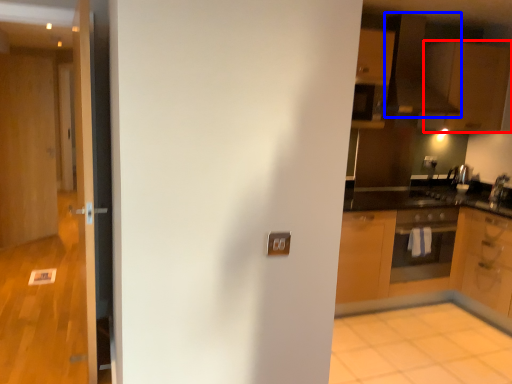
Question: Which of the following is the closest to the observer, cabinetry (highlighted by a red box) or exhaust hood (highlighted by a blue box)?

Choices:
 (A) cabinetry
 (B) exhaust hood

Answer: (B)